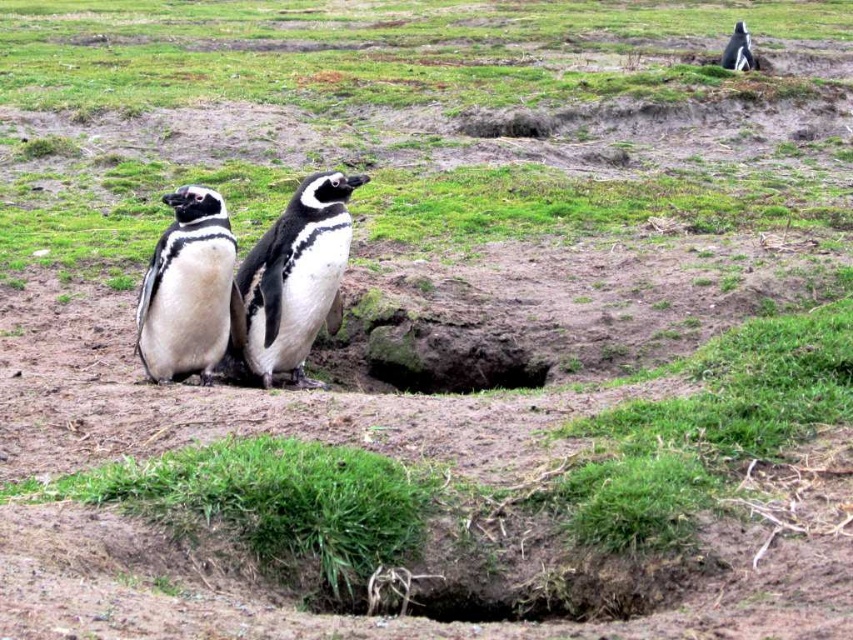
Question: Considering the real-world distances, which object is closest to the black and white feathers at center?

Choices:
 (A) white glossy penguin at center
 (B) black glossy penguin at upper right

Answer: (A)

Question: Is white glossy penguin at center below black glossy penguin at upper right?

Choices:
 (A) no
 (B) yes

Answer: (B)

Question: In this image, where is white glossy penguin at center located relative to black glossy penguin at upper right?

Choices:
 (A) right
 (B) left

Answer: (B)

Question: Which point is farther to the camera?

Choices:
 (A) (312, 176)
 (B) (730, 35)
 (C) (190, 346)
 (D) (416, 388)

Answer: (B)

Question: Does black and white feathers at center have a lesser width compared to dark soil hole at center?

Choices:
 (A) yes
 (B) no

Answer: (A)

Question: Which point is farther to the camera?

Choices:
 (A) black glossy penguin at upper right
 (B) dark soil hole at center

Answer: (A)